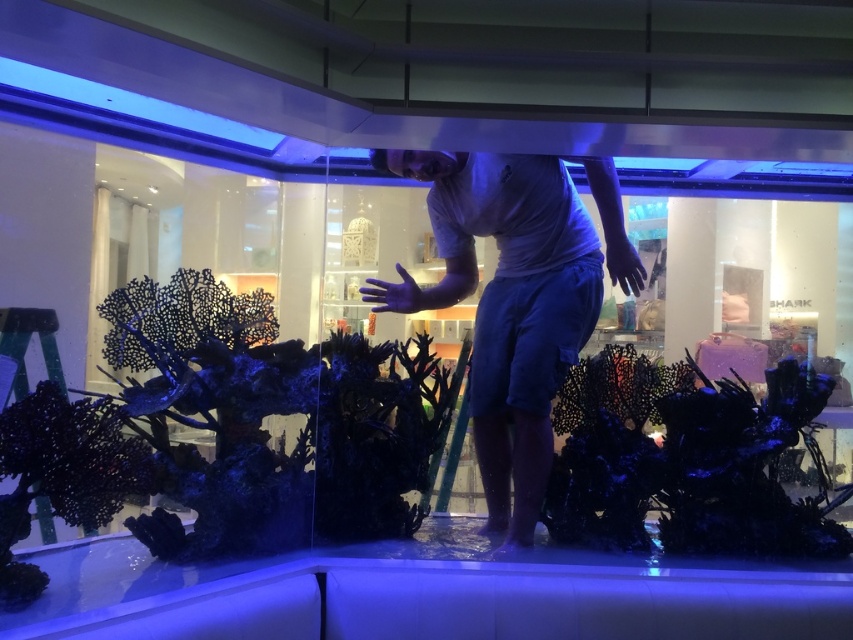
Does white matte shirt at center appear on the right side of black matte coral at center?

In fact, white matte shirt at center is to the left of black matte coral at center.

Is white matte shirt at center taller than black matte coral at center?

Yes.

Does point (463, 152) come closer to viewer compared to point (671, 436)?

Yes, it is in front of point (671, 436).

At what (x,y) coordinates should I click in order to perform the action: click on white matte shirt at center. Please return your answer as a coordinate pair (x, y). The width and height of the screenshot is (853, 640). Looking at the image, I should click on (506, 305).